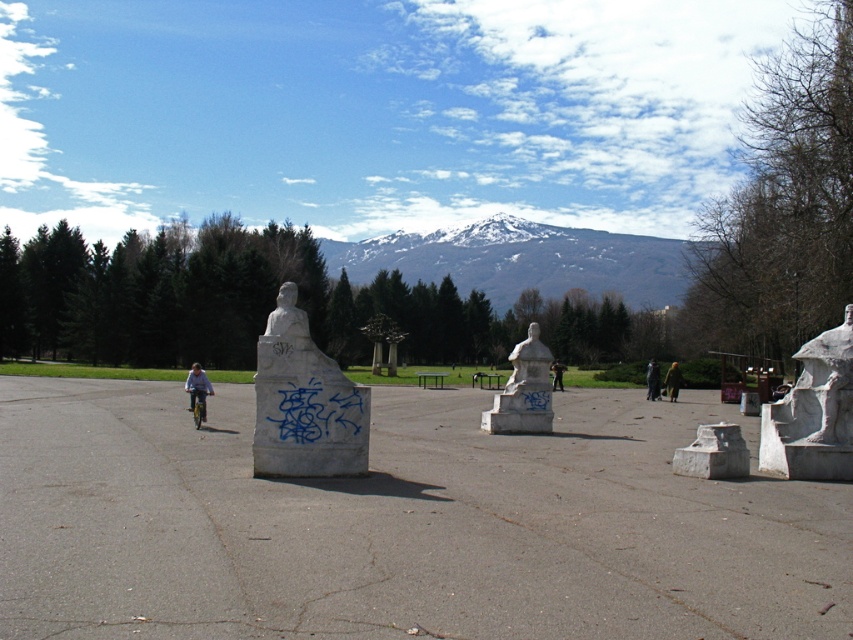
Question: From the image, what is the correct spatial relationship of white stone statue at right in relation to white marble statue at center?

Choices:
 (A) below
 (B) above

Answer: (B)

Question: Estimate the real-world distances between objects in this image. Which object is closer to the yellow metallic bicycle at center-left?

Choices:
 (A) golden hair at center
 (B) white stone bust at center
 (C) light blue fabric jacket at left

Answer: (C)

Question: Which point is farther to the camera?

Choices:
 (A) (186, 381)
 (B) (288, 289)
 (C) (671, 368)

Answer: (C)

Question: Is snowy rock mountain at upper center to the right of light blue fabric jacket at left from the viewer's perspective?

Choices:
 (A) no
 (B) yes

Answer: (B)

Question: Is white marble statue at center bigger than dark blue jacket at center?

Choices:
 (A) yes
 (B) no

Answer: (B)

Question: Which of the following is the farthest from the observer?

Choices:
 (A) (291, 349)
 (B) (194, 428)
 (C) (515, 289)
 (D) (192, 384)

Answer: (C)